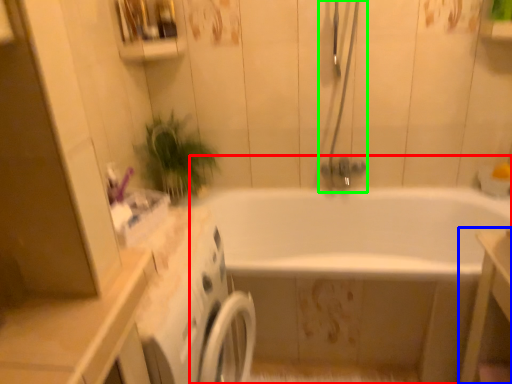
Question: Based on their relative distances, which object is nearer to bathtub (highlighted by a red box)? Choose from vanity (highlighted by a blue box) and shower door (highlighted by a green box).

Choices:
 (A) vanity
 (B) shower door

Answer: (B)